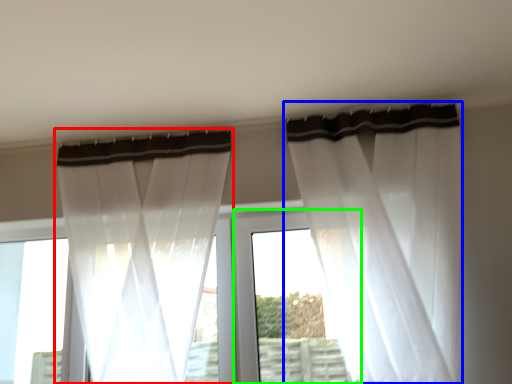
Question: Considering the real-world distances, which object is closest to curtain (highlighted by a red box)? curtain (highlighted by a blue box) or window frame (highlighted by a green box).

Choices:
 (A) curtain
 (B) window frame

Answer: (B)